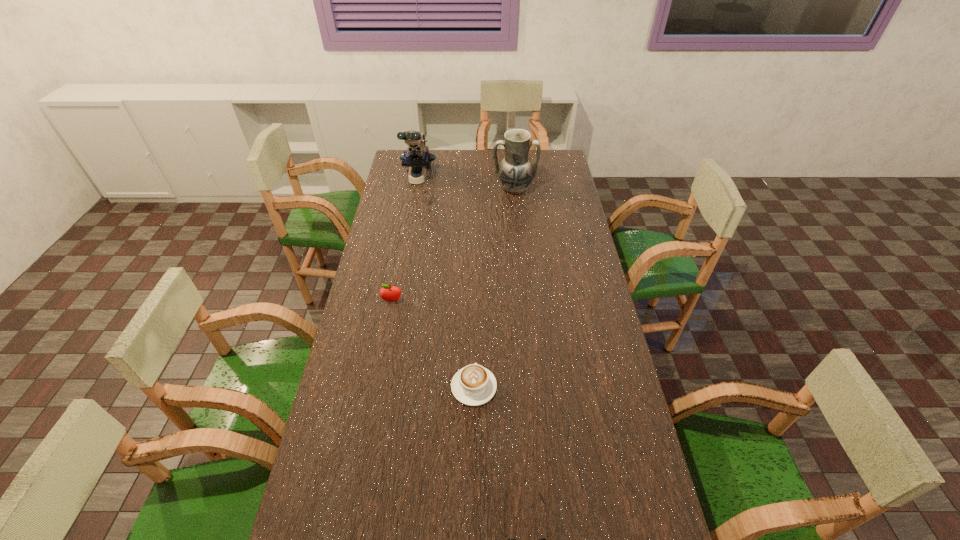
Where is `vacant area situated with the handle on the right side of the cappuccino`? vacant area situated with the handle on the right side of the cappuccino is located at coordinates (475, 290).

Where is `vacant region located 0.160m with the handle on the right side of the cappuccino`? vacant region located 0.160m with the handle on the right side of the cappuccino is located at coordinates (474, 327).

The image size is (960, 540). In order to click on object present at the far edge in this screenshot , I will do `click(418, 159)`.

Locate an element on the screen. The width and height of the screenshot is (960, 540). microscope positioned at the left edge is located at coordinates (418, 159).

You are a GUI agent. You are given a task and a screenshot of the screen. Output one action in this format:
    pyautogui.click(x=<x>, y=<y>)
    Task: Click on the apple present at the left edge
    The image size is (960, 540).
    Given the screenshot: What is the action you would take?
    pyautogui.click(x=391, y=294)

At what (x,y) coordinates should I click in order to perform the action: click on object situated at the far left corner. Please return your answer as a coordinate pair (x, y). Looking at the image, I should click on (418, 159).

Find the location of a particular element. The image size is (960, 540). free location at the far edge is located at coordinates (453, 154).

In the image, there is a desktop. At what (x,y) coordinates should I click in order to perform the action: click on vacant space at the left edge. Please return your answer as a coordinate pair (x, y). The height and width of the screenshot is (540, 960). Looking at the image, I should click on (393, 325).

Locate an element on the screen. vacant space at the right edge of the desktop is located at coordinates (559, 313).

Image resolution: width=960 pixels, height=540 pixels. Find the location of `vacant area between the microscope and the fourth farthest object`. vacant area between the microscope and the fourth farthest object is located at coordinates (445, 282).